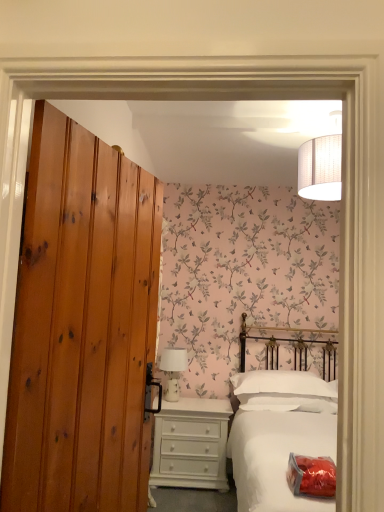
Question: Can knotty pine door at left be found inside white painted wood chest of drawers at lower center?

Choices:
 (A) no
 (B) yes

Answer: (A)

Question: Does white painted wood chest of drawers at lower center have a lesser height compared to knotty pine door at left?

Choices:
 (A) no
 (B) yes

Answer: (B)

Question: Is white painted wood chest of drawers at lower center facing away from knotty pine door at left?

Choices:
 (A) no
 (B) yes

Answer: (A)

Question: From the image's perspective, is white painted wood chest of drawers at lower center below knotty pine door at left?

Choices:
 (A) no
 (B) yes

Answer: (B)

Question: Is white painted wood chest of drawers at lower center bigger than knotty pine door at left?

Choices:
 (A) no
 (B) yes

Answer: (B)

Question: Can you confirm if white painted wood chest of drawers at lower center is wider than knotty pine door at left?

Choices:
 (A) no
 (B) yes

Answer: (B)

Question: Considering the relative sizes of knotty pine door at left and white soft pillow at center in the image provided, is knotty pine door at left bigger than white soft pillow at center?

Choices:
 (A) no
 (B) yes

Answer: (B)

Question: From a real-world perspective, is knotty pine door at left located higher than white soft pillow at center?

Choices:
 (A) no
 (B) yes

Answer: (B)

Question: Is the depth of knotty pine door at left greater than that of white soft pillow at center?

Choices:
 (A) yes
 (B) no

Answer: (B)

Question: Could white soft pillow at center be considered to be inside knotty pine door at left?

Choices:
 (A) no
 (B) yes

Answer: (A)

Question: Is knotty pine door at left oriented away from white soft pillow at center?

Choices:
 (A) yes
 (B) no

Answer: (B)

Question: Are knotty pine door at left and white soft pillow at center making contact?

Choices:
 (A) no
 (B) yes

Answer: (A)

Question: Can you confirm if white matte bed at center is wider than white soft pillow at center?

Choices:
 (A) yes
 (B) no

Answer: (A)